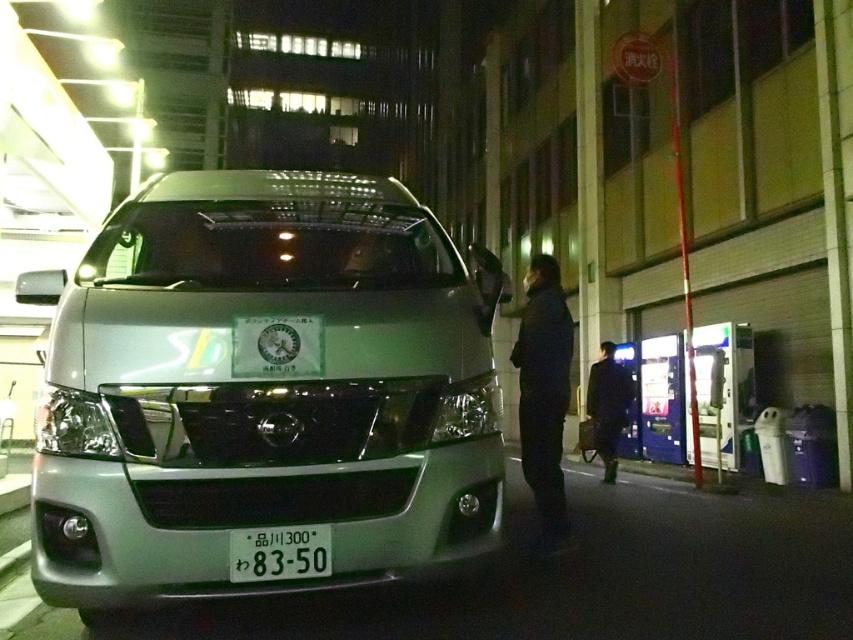
Question: Does black matte jacket at center have a smaller size compared to dark blue coat at center?

Choices:
 (A) no
 (B) yes

Answer: (B)

Question: Is satin silver van at center further to the viewer compared to dark blue coat at center?

Choices:
 (A) no
 (B) yes

Answer: (A)

Question: Estimate the real-world distances between objects in this image. Which object is farther from the dark blue coat at center?

Choices:
 (A) white plastic license plate at center
 (B) black matte jacket at center

Answer: (A)

Question: Can you confirm if satin silver van at center is bigger than black matte jacket at center?

Choices:
 (A) yes
 (B) no

Answer: (A)

Question: Estimate the real-world distances between objects in this image. Which object is closer to the black matte jacket at center?

Choices:
 (A) white plastic license plate at center
 (B) satin silver van at center
 (C) dark blue coat at center

Answer: (B)

Question: Which object appears closest to the camera in this image?

Choices:
 (A) dark blue coat at center
 (B) satin silver van at center

Answer: (B)